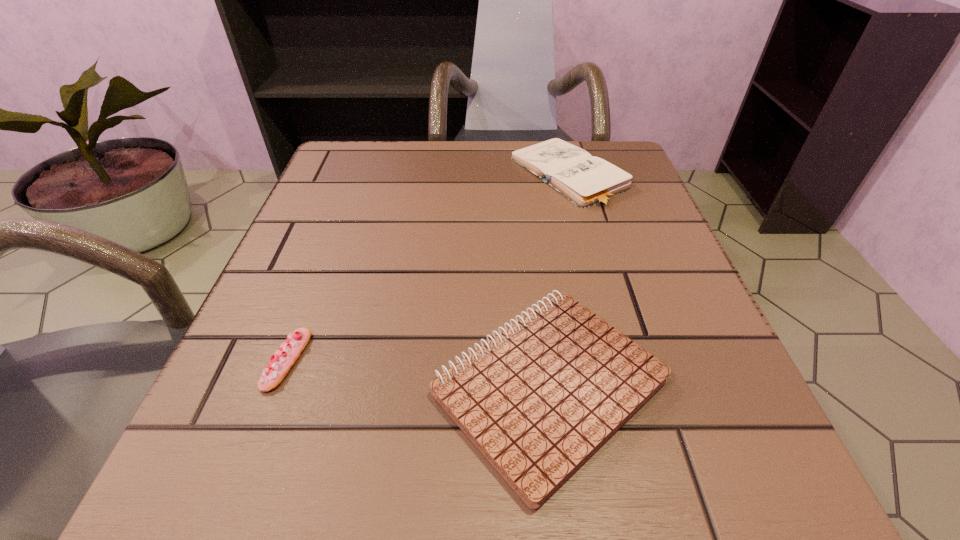
Locate an element on the screen. The height and width of the screenshot is (540, 960). the farthest object is located at coordinates (587, 181).

Identify the location of the nearer notebook. This screenshot has width=960, height=540. (538, 400).

The image size is (960, 540). I want to click on eclair, so click(285, 357).

The height and width of the screenshot is (540, 960). I want to click on vacant space located 0.310m on the front of the farther notebook, so click(616, 350).

This screenshot has width=960, height=540. In order to click on blank space located 0.220m on the back of the nearer notebook in this screenshot , I will do `click(527, 214)`.

This screenshot has height=540, width=960. What are the coordinates of `vacant space situated 0.190m on the right of the eclair` in the screenshot? It's located at (444, 360).

Find the location of a particular element. This screenshot has width=960, height=540. object located in the far edge section of the desktop is located at coordinates point(587,181).

Where is `object that is positioned at the near edge`? object that is positioned at the near edge is located at coordinates pyautogui.click(x=538, y=400).

What are the coordinates of `object at the left edge` in the screenshot? It's located at (285, 357).

Locate an element on the screen. This screenshot has width=960, height=540. object at the far right corner is located at coordinates coord(587,181).